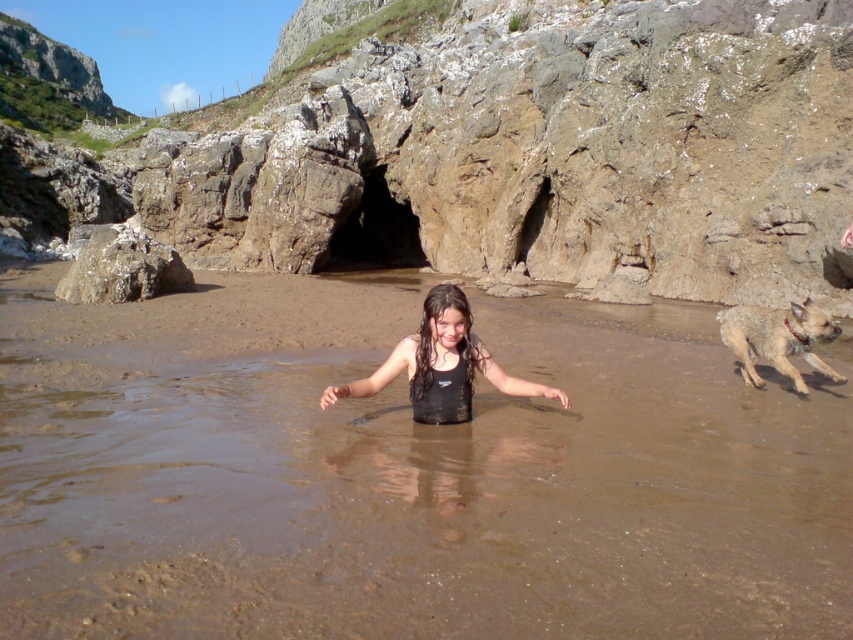
Which is in front, point (115, 401) or point (184, 278)?

Point (115, 401)

I want to click on brown wet sand at center, so click(x=405, y=474).

Is black matte swimsuit at center smaller than brown furry dog at right?

Incorrect, black matte swimsuit at center is not smaller in size than brown furry dog at right.

Locate an element on the screen. This screenshot has height=640, width=853. black matte swimsuit at center is located at coordinates (440, 364).

Which is above, black matte swimsuit at center or smooth gray rock at center?

smooth gray rock at center is higher up.

Does black matte swimsuit at center have a greater height compared to smooth gray rock at center?

No.

Based on the photo, who is more forward, (434,413) or (132,282)?

Point (434,413)

Locate an element on the screen. The width and height of the screenshot is (853, 640). black matte swimsuit at center is located at coordinates (440, 364).